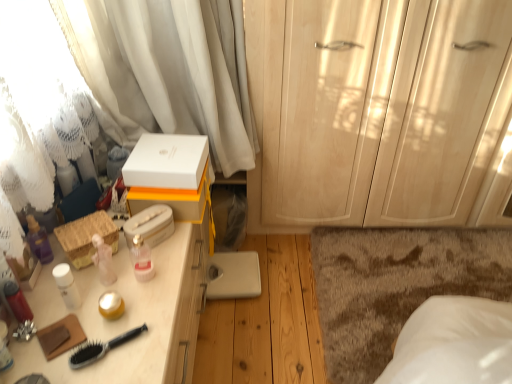
Identify the location of vacant space behind pink glossy bottle at center, which is counted as the 2th toiletry, starting from the front. The image size is (512, 384). (156, 250).